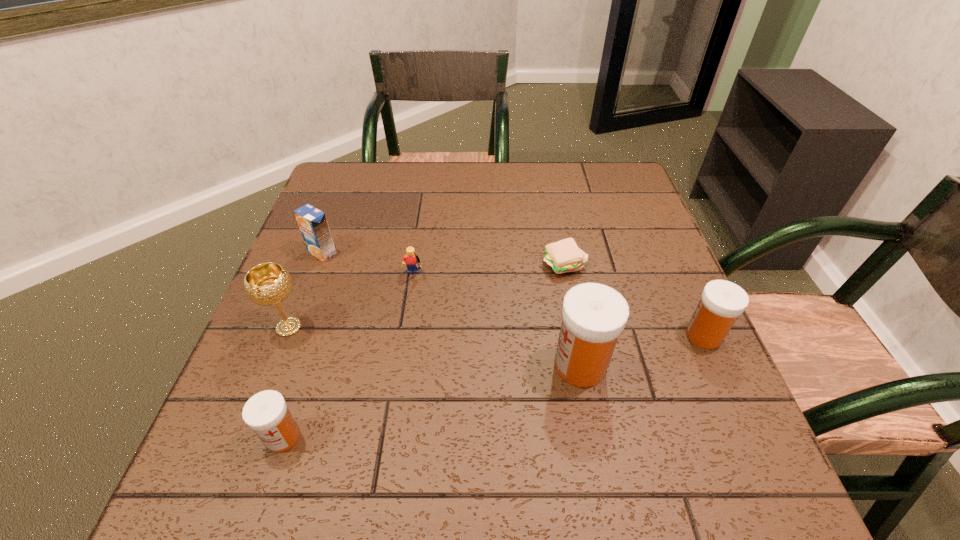
Find the location of a particular element. Image resolution: width=960 pixels, height=540 pixels. vacant space located on the left of the tallest medicine is located at coordinates (347, 366).

The image size is (960, 540). Find the location of `free space located 0.120m on the front of the rightmost medicine`. free space located 0.120m on the front of the rightmost medicine is located at coordinates (735, 406).

At what (x,y) coordinates should I click in order to perform the action: click on free spot located 0.290m on the right of the orange_juice. Please return your answer as a coordinate pair (x, y). Image resolution: width=960 pixels, height=540 pixels. Looking at the image, I should click on (454, 253).

Find the location of a particular element. free point located 0.190m on the front-facing side of the fourth object from right to left is located at coordinates (401, 356).

At what (x,y) coordinates should I click in order to perform the action: click on free location located on the front of the patty. Please return your answer as a coordinate pair (x, y). Image resolution: width=960 pixels, height=540 pixels. Looking at the image, I should click on (585, 367).

The image size is (960, 540). What are the coordinates of `blank area located 0.060m on the back of the chalice` in the screenshot? It's located at (302, 292).

Identify the location of object that is at the near edge. (266, 413).

This screenshot has height=540, width=960. What are the coordinates of `medicine located in the left edge section of the desktop` in the screenshot? It's located at (266, 413).

At what (x,y) coordinates should I click in order to perform the action: click on orange_juice that is positioned at the left edge. Please return your answer as a coordinate pair (x, y). This screenshot has height=540, width=960. Looking at the image, I should click on point(312,222).

Locate an element on the screen. The image size is (960, 540). chalice that is at the left edge is located at coordinates (266, 284).